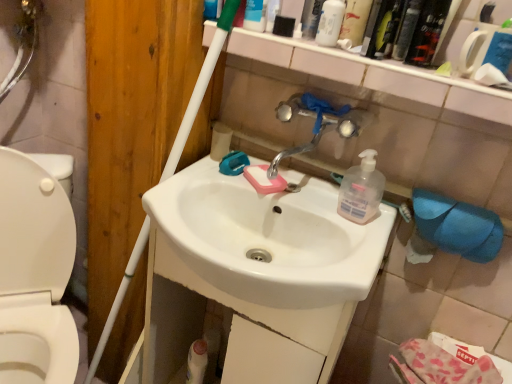
Where is `vacant space that is to the left of translucent plastic mouthwash at upper right, the 3th mouthwash positioned from the right`? Image resolution: width=512 pixels, height=384 pixels. vacant space that is to the left of translucent plastic mouthwash at upper right, the 3th mouthwash positioned from the right is located at coordinates (312, 44).